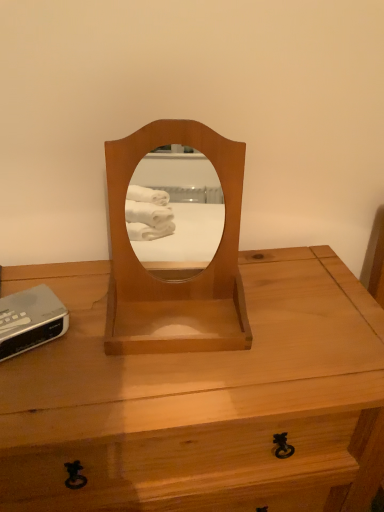
Question: Considering the relative sizes of silver plastic clock at lower left and light brown wood mirror at center in the image provided, is silver plastic clock at lower left wider than light brown wood mirror at center?

Choices:
 (A) yes
 (B) no

Answer: (B)

Question: Would you consider silver plastic clock at lower left to be distant from light brown wood mirror at center?

Choices:
 (A) no
 (B) yes

Answer: (A)

Question: Is silver plastic clock at lower left oriented away from light brown wood mirror at center?

Choices:
 (A) yes
 (B) no

Answer: (B)

Question: Could you tell me if silver plastic clock at lower left is facing light brown wood mirror at center?

Choices:
 (A) no
 (B) yes

Answer: (A)

Question: Is silver plastic clock at lower left next to light brown wood mirror at center and touching it?

Choices:
 (A) no
 (B) yes

Answer: (A)

Question: Does silver plastic clock at lower left come behind light brown wood mirror at center?

Choices:
 (A) yes
 (B) no

Answer: (A)

Question: Is light brown wood desk at center at the left side of light brown wood mirror at center?

Choices:
 (A) yes
 (B) no

Answer: (A)

Question: Does light brown wood desk at center have a greater height compared to light brown wood mirror at center?

Choices:
 (A) no
 (B) yes

Answer: (B)

Question: Are light brown wood desk at center and light brown wood mirror at center making contact?

Choices:
 (A) yes
 (B) no

Answer: (B)

Question: Is light brown wood desk at center shorter than light brown wood mirror at center?

Choices:
 (A) no
 (B) yes

Answer: (A)

Question: Considering the relative positions of light brown wood desk at center and light brown wood mirror at center in the image provided, is light brown wood desk at center to the right of light brown wood mirror at center from the viewer's perspective?

Choices:
 (A) yes
 (B) no

Answer: (B)

Question: Does light brown wood desk at center have a larger size compared to light brown wood mirror at center?

Choices:
 (A) no
 (B) yes

Answer: (B)

Question: Is silver plastic clock at lower left in front of light brown wood desk at center?

Choices:
 (A) no
 (B) yes

Answer: (A)